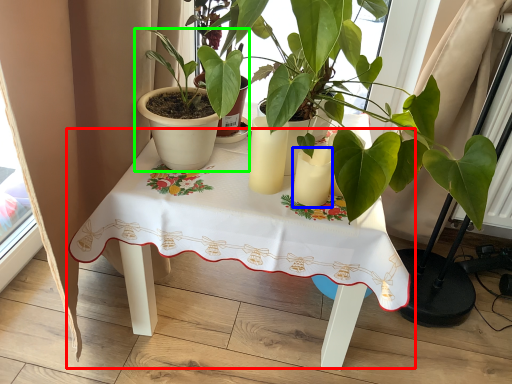
Question: Which object is positioned closest to table (highlighted by a red box)? Select from candle holder (highlighted by a blue box) and houseplant (highlighted by a green box).

Choices:
 (A) candle holder
 (B) houseplant

Answer: (B)